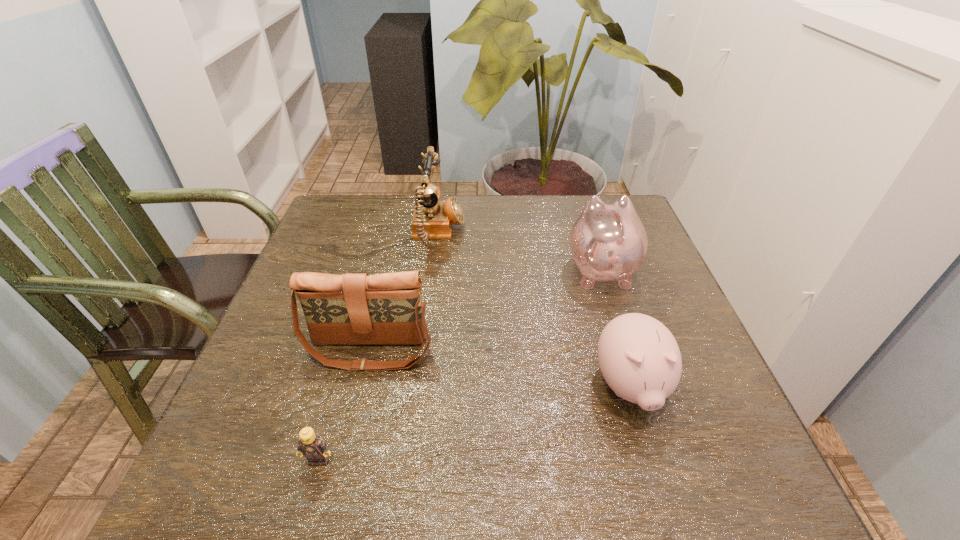
What are the coordinates of `free space located on the front facing side of the taller piggy bank` in the screenshot? It's located at (583, 214).

The image size is (960, 540). Identify the location of vacant region located 0.190m on the front-facing side of the shoulder bag. (341, 467).

Find the location of a particular element. vacant area located 0.090m at the snout of the fourth tallest object is located at coordinates (659, 483).

Find the location of a particular element. The width and height of the screenshot is (960, 540). object that is at the far edge is located at coordinates (433, 218).

The image size is (960, 540). What are the coordinates of `object at the near edge` in the screenshot? It's located at (311, 445).

You are a GUI agent. You are given a task and a screenshot of the screen. Output one action in this format:
    pyautogui.click(x=<x>, y=<y>)
    Task: Click on the shoulder bag that is at the left edge
    The image size is (960, 540).
    Given the screenshot: What is the action you would take?
    pyautogui.click(x=350, y=309)

The width and height of the screenshot is (960, 540). I want to click on Lego that is at the left edge, so click(x=311, y=445).

You are a GUI agent. You are given a task and a screenshot of the screen. Output one action in this format:
    pyautogui.click(x=<x>, y=<y>)
    Task: Click on the object situated at the near left corner
    This screenshot has width=960, height=540.
    Given the screenshot: What is the action you would take?
    pyautogui.click(x=311, y=445)

In the image, there is a desktop. Identify the location of vacant area at the far edge. (561, 226).

In the image, there is a desktop. At what (x,y) coordinates should I click in order to perform the action: click on free space at the near edge. Please return your answer as a coordinate pair (x, y). The width and height of the screenshot is (960, 540). Looking at the image, I should click on (522, 474).